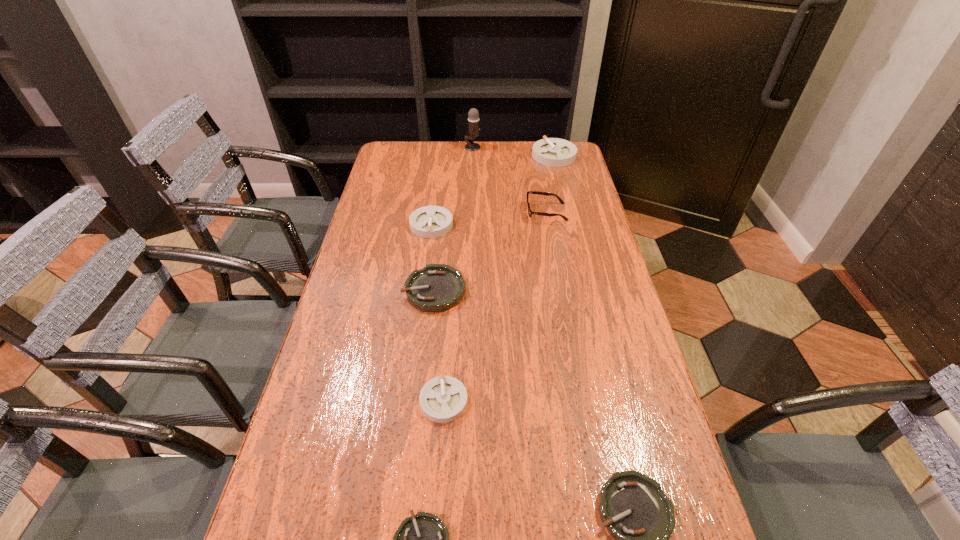
Find the location of `ashtray located in the far edge section of the desktop`. ashtray located in the far edge section of the desktop is located at coordinates (554, 152).

The width and height of the screenshot is (960, 540). Identify the location of object that is positioned at the left edge. (429, 221).

What are the coordinates of `ashtray that is at the right edge` in the screenshot? It's located at (554, 152).

Locate an element on the screen. spectacles located at the right edge is located at coordinates tap(530, 212).

Locate an element on the screen. Image resolution: width=960 pixels, height=540 pixels. object that is positioned at the far right corner is located at coordinates (554, 152).

The height and width of the screenshot is (540, 960). In the image, there is a desktop. What are the coordinates of `free space at the far edge` in the screenshot? It's located at (490, 154).

In order to click on vacant region at the right edge of the desktop in this screenshot , I will do `click(613, 448)`.

Locate an element on the screen. free space at the far left corner of the desktop is located at coordinates (387, 163).

I want to click on unoccupied area between the farthest green ashtray and the spectacles, so click(491, 251).

Where is `unoccupied position between the fifth shortest ashtray and the smallest gray ashtray`? Image resolution: width=960 pixels, height=540 pixels. unoccupied position between the fifth shortest ashtray and the smallest gray ashtray is located at coordinates (438, 313).